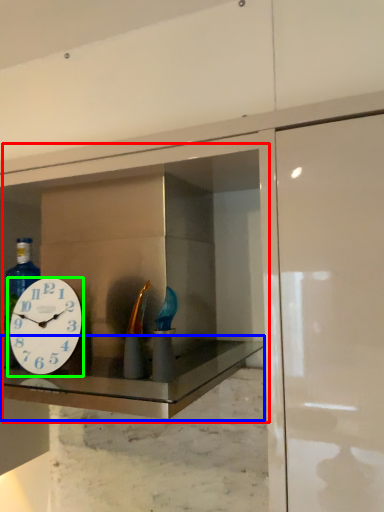
Question: Considering the real-world distances, which object is closest to medicine cabinet (highlighted by a red box)? counter top (highlighted by a blue box) or wall clock (highlighted by a green box).

Choices:
 (A) counter top
 (B) wall clock

Answer: (A)